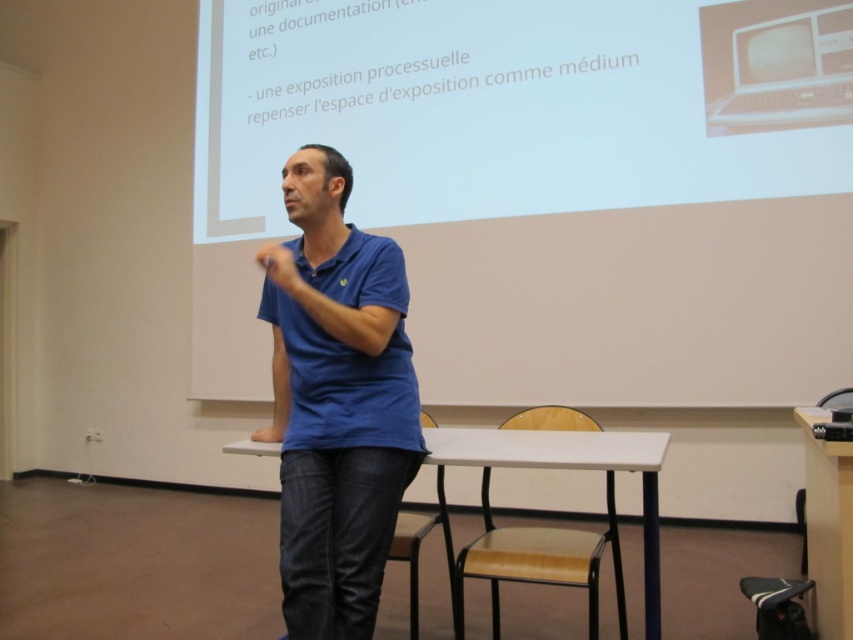
Question: From the image, what is the correct spatial relationship of white glossy projector screen at upper center in relation to blue cotton shirt at center?

Choices:
 (A) below
 (B) above

Answer: (B)

Question: Which point is closer to the camera?

Choices:
 (A) (793, 22)
 (B) (339, 170)

Answer: (B)

Question: From the image, what is the correct spatial relationship of white glossy projector screen at upper center in relation to blue cotton shirt at center?

Choices:
 (A) right
 (B) left

Answer: (A)

Question: Considering the relative positions of white glossy projector screen at upper center and blue cotton shirt at center in the image provided, where is white glossy projector screen at upper center located with respect to blue cotton shirt at center?

Choices:
 (A) above
 (B) below

Answer: (A)